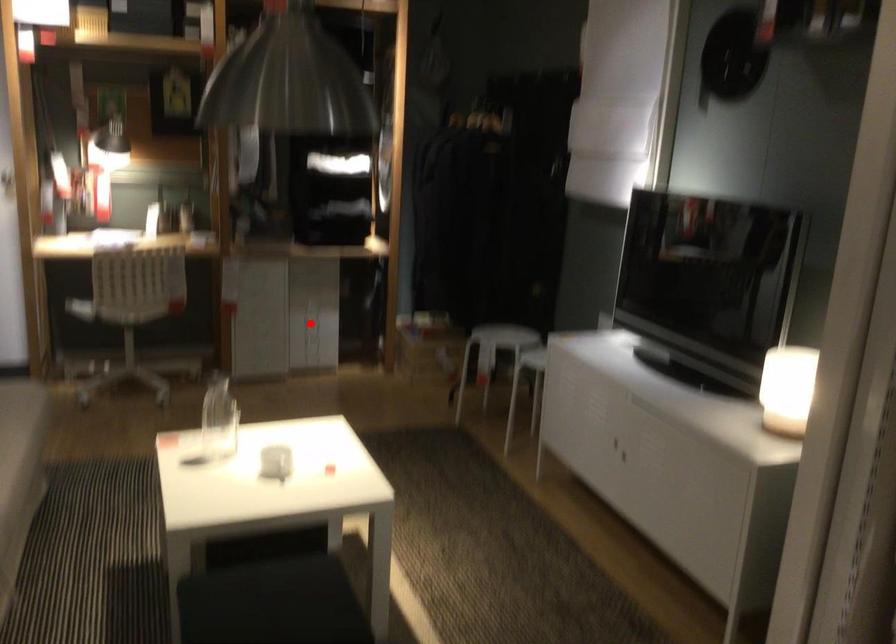
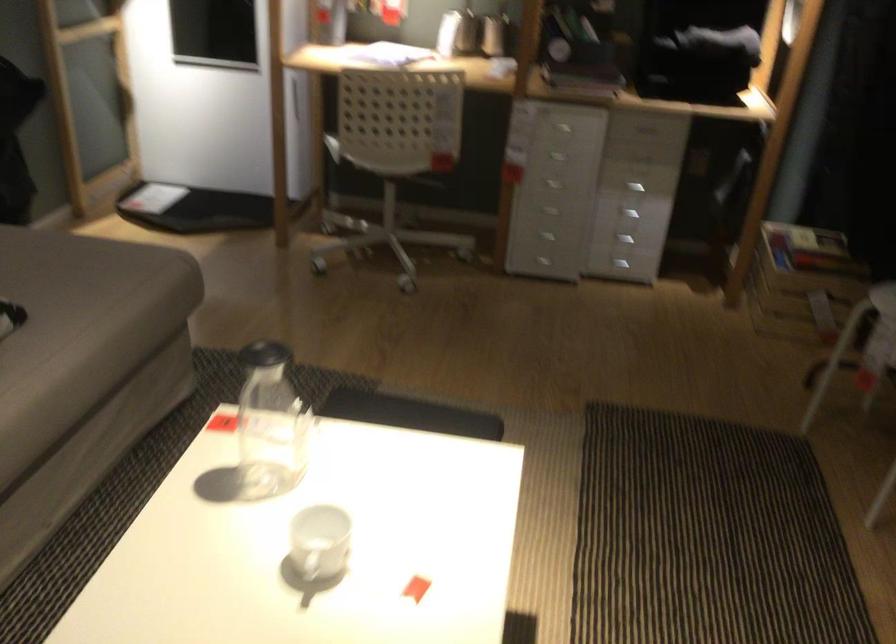
Find the pixel in the second image that matches the highlighted location in the first image.

(627, 214)